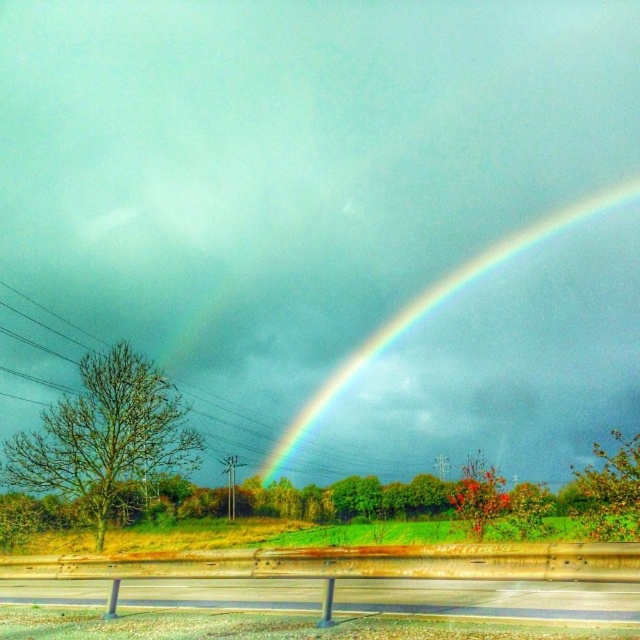
Looking at this image, you are a photographer trying to capture the rainbow at upper center and the metallic gray highway at lower center in a single frame. Based on their sizes in the image, which object would you focus on first to ensure both are clearly visible?

The metallic gray highway at lower center occupies less space than the rainbow at upper center, so you should focus on the rainbow at upper center first to ensure both are clearly visible.

You are standing at the edge of the road and notice the metallic gray highway at lower center. Based on its position, can you determine if it is closer to you or further away compared to the rainbow?

The metallic gray highway at lower center is located at point (490, 598), which places it closer to the viewer than the rainbow, so it is closer.